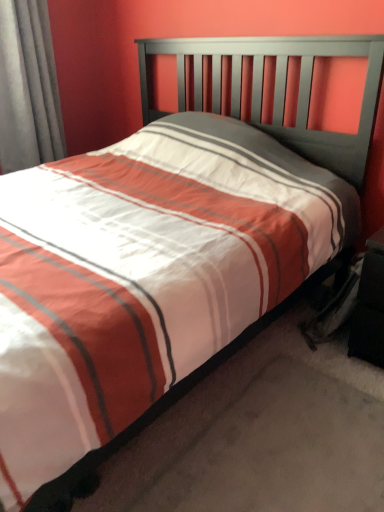
Question: Considering the relative sizes of gray fabric curtain at left and black fabric nightstand at lower right in the image provided, is gray fabric curtain at left shorter than black fabric nightstand at lower right?

Choices:
 (A) yes
 (B) no

Answer: (B)

Question: Does gray fabric curtain at left have a larger size compared to black fabric nightstand at lower right?

Choices:
 (A) yes
 (B) no

Answer: (A)

Question: Are gray fabric curtain at left and black fabric nightstand at lower right making contact?

Choices:
 (A) no
 (B) yes

Answer: (A)

Question: Is gray fabric curtain at left wider than black fabric nightstand at lower right?

Choices:
 (A) no
 (B) yes

Answer: (A)

Question: Would you say gray fabric curtain at left contains black fabric nightstand at lower right?

Choices:
 (A) no
 (B) yes

Answer: (A)

Question: Does gray fabric curtain at left appear on the right side of black fabric nightstand at lower right?

Choices:
 (A) no
 (B) yes

Answer: (A)

Question: Does black fabric nightstand at lower right have a greater height compared to gray fabric curtain at left?

Choices:
 (A) yes
 (B) no

Answer: (B)

Question: Considering the relative positions of black fabric nightstand at lower right and gray fabric curtain at left in the image provided, is black fabric nightstand at lower right to the right of gray fabric curtain at left from the viewer's perspective?

Choices:
 (A) no
 (B) yes

Answer: (B)

Question: From a real-world perspective, does black fabric nightstand at lower right sit lower than gray fabric curtain at left?

Choices:
 (A) yes
 (B) no

Answer: (A)

Question: From the image's perspective, is black fabric nightstand at lower right under gray fabric curtain at left?

Choices:
 (A) yes
 (B) no

Answer: (A)

Question: Is gray fabric curtain at left at the back of black fabric nightstand at lower right?

Choices:
 (A) yes
 (B) no

Answer: (B)

Question: Would you say black fabric nightstand at lower right is outside gray fabric curtain at left?

Choices:
 (A) yes
 (B) no

Answer: (A)

Question: In terms of height, does gray fabric curtain at left look taller or shorter compared to black fabric nightstand at lower right?

Choices:
 (A) short
 (B) tall

Answer: (B)